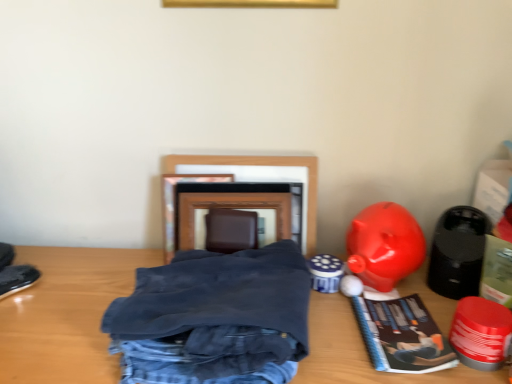
What are the coordinates of `blank space to the left of dark blue cotton pants at center` in the screenshot? It's located at (69, 319).